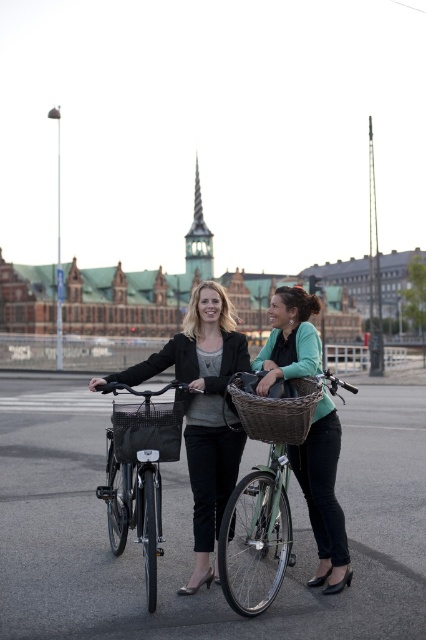
Which is above, matte green bicycle at center or matte black bicycle at center?

matte green bicycle at center is higher up.

Which is behind, point (322, 572) or point (112, 422)?

The point (112, 422) is behind.

Is point (259, 369) farther from camera compared to point (112, 513)?

Yes, point (259, 369) is farther from viewer.

The width and height of the screenshot is (426, 640). What are the coordinates of `matte green bicycle at center` in the screenshot? It's located at (324, 496).

Which is below, matte black bicycle at center or woven brown basket at center?

Positioned lower is matte black bicycle at center.

From the picture: Which is above, matte black bicycle at center or woven brown basket at center?

Positioned higher is woven brown basket at center.

Between point (146, 504) and point (299, 419), which one is positioned in front?

Point (146, 504) is in front.

Image resolution: width=426 pixels, height=640 pixels. What are the coordinates of `matte black bicycle at center` in the screenshot? It's located at (140, 472).

Can you confirm if matte green bicycle at center is taller than woven brown basket at center?

Yes, matte green bicycle at center is taller than woven brown basket at center.

Who is more forward, (337, 433) or (258, 426)?

Point (258, 426)

The height and width of the screenshot is (640, 426). I want to click on matte green bicycle at center, so click(324, 496).